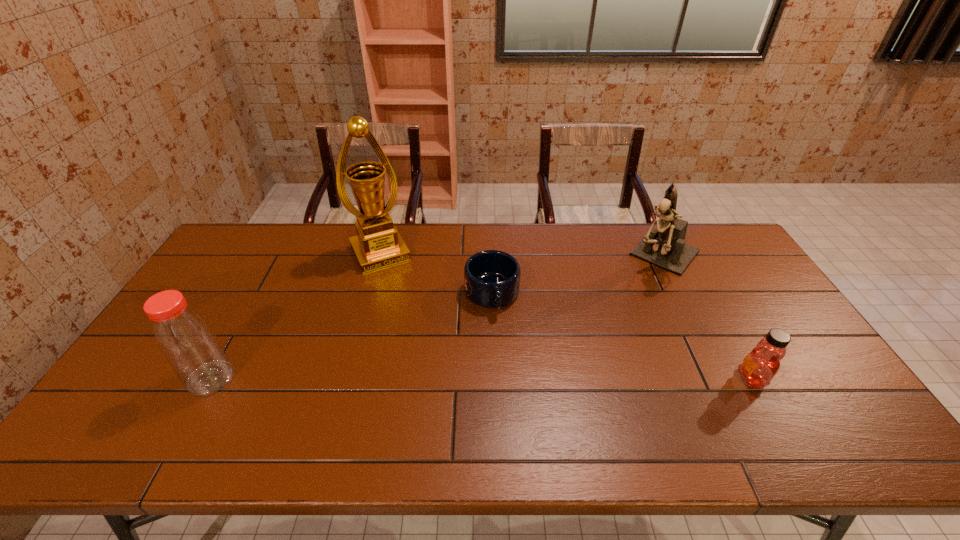
Find the location of `vacant space at the near edge`. vacant space at the near edge is located at coordinates (584, 396).

This screenshot has width=960, height=540. In the image, there is a desktop. In order to click on vacant space at the left edge in this screenshot , I will do `click(221, 290)`.

You are a GUI agent. You are given a task and a screenshot of the screen. Output one action in this format:
    pyautogui.click(x=<x>, y=<y>)
    Task: Click on the vacant area at the far left corner of the desktop
    The width and height of the screenshot is (960, 540).
    Given the screenshot: What is the action you would take?
    [x=243, y=247]

The width and height of the screenshot is (960, 540). I want to click on free spot at the far right corner of the desktop, so click(x=708, y=249).

This screenshot has height=540, width=960. Find the location of `free space at the near right corner`. free space at the near right corner is located at coordinates (815, 389).

The image size is (960, 540). What are the coordinates of `free area in between the second tallest object and the mug` in the screenshot? It's located at (578, 275).

I want to click on free spot between the figurine and the bottle, so click(x=438, y=317).

Where is `free space between the second object from left to right and the figurine`? This screenshot has width=960, height=540. free space between the second object from left to right and the figurine is located at coordinates (522, 254).

Locate an element on the screen. This screenshot has width=960, height=540. free space that is in between the second object from left to right and the second tallest object is located at coordinates (522, 254).

At what (x,y) coordinates should I click in order to perform the action: click on vacant space that is in between the leftmost object and the award. Please return your answer as a coordinate pair (x, y). This screenshot has height=540, width=960. Looking at the image, I should click on (296, 315).